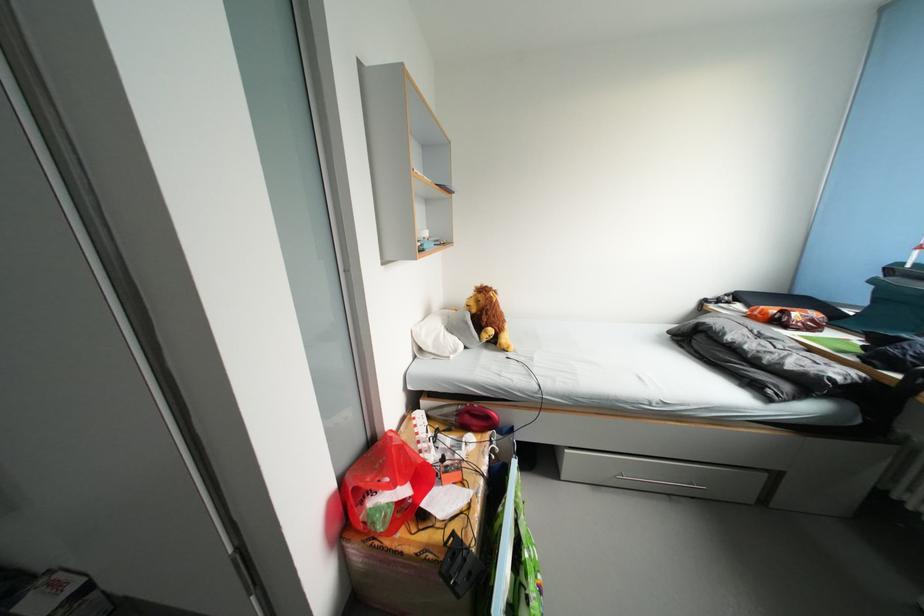
Locate an element on the screen. The height and width of the screenshot is (616, 924). stuffed lion toy is located at coordinates (488, 317).